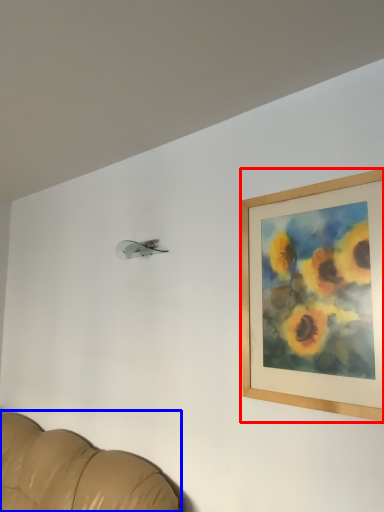
Question: Which object is further to the camera taking this photo, picture frame (highlighted by a red box) or furniture (highlighted by a blue box)?

Choices:
 (A) picture frame
 (B) furniture

Answer: (A)